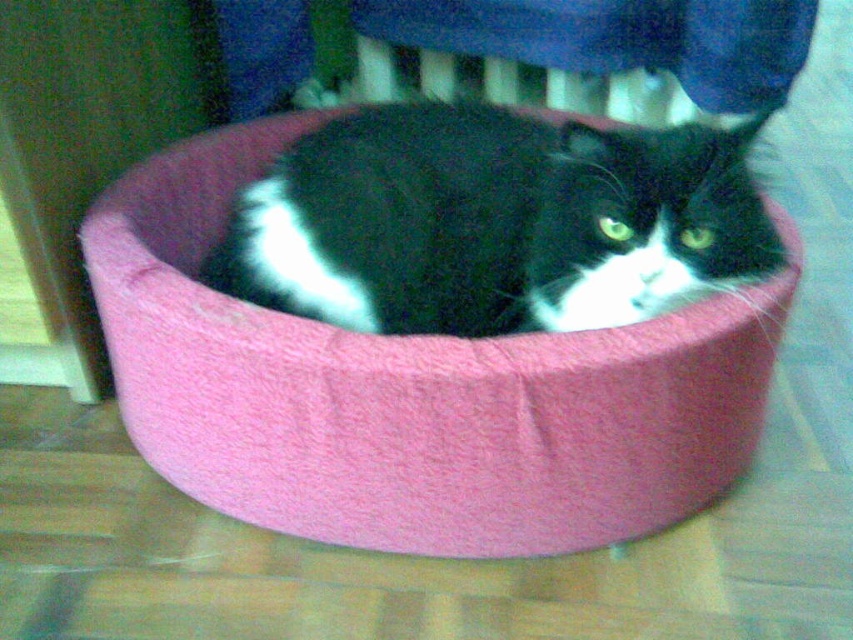
Question: From the image, what is the correct spatial relationship of pink plush cat bed at center in relation to black fuzzy cat at center?

Choices:
 (A) right
 (B) left

Answer: (B)

Question: Which point appears farthest from the camera in this image?

Choices:
 (A) (248, 442)
 (B) (743, 246)

Answer: (A)

Question: Which point appears closest to the camera in this image?

Choices:
 (A) (262, 404)
 (B) (746, 204)

Answer: (A)

Question: Is pink plush cat bed at center positioned at the back of black fuzzy cat at center?

Choices:
 (A) no
 (B) yes

Answer: (A)

Question: Is the position of pink plush cat bed at center less distant than that of black fuzzy cat at center?

Choices:
 (A) no
 (B) yes

Answer: (B)